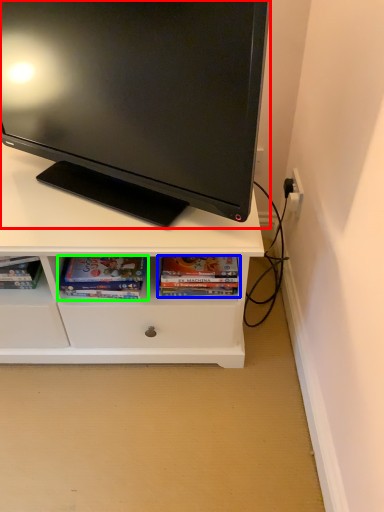
Question: Estimate the real-world distances between objects in this image. Which object is farther from television (highlighted by a red box), book (highlighted by a blue box) or book (highlighted by a green box)?

Choices:
 (A) book
 (B) book

Answer: (A)